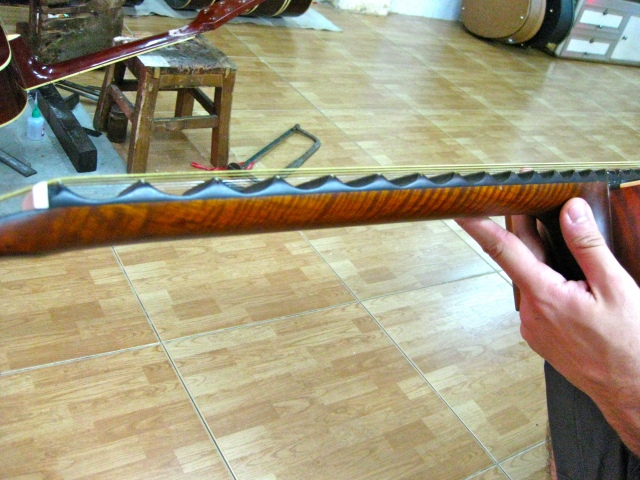
Identify the location of stand. (24, 169).